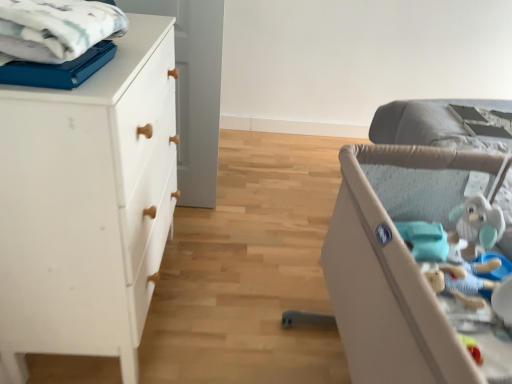
Describe the element at coordinates (399, 265) in the screenshot. The width and height of the screenshot is (512, 384). I see `beige fabric infant bed at right` at that location.

Image resolution: width=512 pixels, height=384 pixels. What are the coordinates of `white matte chest of drawers at left` in the screenshot? It's located at (87, 204).

Does white cotton blanket at upper left have a lesser width compared to white matte chest of drawers at left?

Indeed, white cotton blanket at upper left has a lesser width compared to white matte chest of drawers at left.

Does white cotton blanket at upper left come behind white matte chest of drawers at left?

No, white cotton blanket at upper left is in front of white matte chest of drawers at left.

From the picture: Between white cotton blanket at upper left and white matte chest of drawers at left, which one has larger size?

white matte chest of drawers at left.

Is white cotton blanket at upper left not near white matte chest of drawers at left?

white cotton blanket at upper left is near white matte chest of drawers at left, not far away.

From a real-world perspective, is white matte chest of drawers at left positioned above or below beige fabric infant bed at right?

white matte chest of drawers at left is above beige fabric infant bed at right.

How much distance is there between white matte chest of drawers at left and beige fabric infant bed at right?

61.08 centimeters.

Could you tell me if white matte chest of drawers at left is turned towards beige fabric infant bed at right?

Yes.

From the image's perspective, between white matte chest of drawers at left and beige fabric infant bed at right, who is located below?

beige fabric infant bed at right appears lower in the image.

Is white matte chest of drawers at left wider or thinner than white cotton blanket at upper left?

Considering their sizes, white matte chest of drawers at left looks broader than white cotton blanket at upper left.

Does point (101, 81) come behind point (54, 45)?

Yes, it is.

Is white matte chest of drawers at left oriented towards white cotton blanket at upper left?

No, white matte chest of drawers at left is not turned towards white cotton blanket at upper left.

Is white matte chest of drawers at left bigger than white cotton blanket at upper left?

Yes.

Is beige fabric infant bed at right smaller than white cotton blanket at upper left?

No, beige fabric infant bed at right is not smaller than white cotton blanket at upper left.

Measure the distance from beige fabric infant bed at right to white cotton blanket at upper left.

beige fabric infant bed at right is 28.58 inches away from white cotton blanket at upper left.

From their relative heights in the image, would you say beige fabric infant bed at right is taller or shorter than white cotton blanket at upper left?

Considering their sizes, beige fabric infant bed at right has more height than white cotton blanket at upper left.

Does point (349, 359) come farther from viewer compared to point (42, 55)?

Yes.

Where is `the chest of drawers located above the beige fabric infant bed at right (from a real-world perspective)`? The width and height of the screenshot is (512, 384). the chest of drawers located above the beige fabric infant bed at right (from a real-world perspective) is located at coordinates (87, 204).

Does point (374, 262) appear closer or farther from the camera than point (65, 110)?

Point (374, 262) is positioned farther from the camera compared to point (65, 110).

Is beige fabric infant bed at right positioned behind white matte chest of drawers at left?

No, beige fabric infant bed at right is closer to the camera.

Is beige fabric infant bed at right next to white matte chest of drawers at left and touching it?

No, beige fabric infant bed at right is not making contact with white matte chest of drawers at left.

Considering the relative sizes of white cotton blanket at upper left and beige fabric infant bed at right in the image provided, is white cotton blanket at upper left thinner than beige fabric infant bed at right?

Correct, the width of white cotton blanket at upper left is less than that of beige fabric infant bed at right.

From the image's perspective, is white cotton blanket at upper left beneath beige fabric infant bed at right?

Incorrect, from the image's perspective, white cotton blanket at upper left is higher than beige fabric infant bed at right.

Looking at this image, is white cotton blanket at upper left located outside beige fabric infant bed at right?

Yes.

Measure the distance from white cotton blanket at upper left to beige fabric infant bed at right.

white cotton blanket at upper left and beige fabric infant bed at right are 28.58 inches apart from each other.

This screenshot has width=512, height=384. In order to click on chest of drawers that appears on the left of white cotton blanket at upper left in this screenshot , I will do `click(87, 204)`.

Where is `infant bed that appears below the white matte chest of drawers at left (from the image's perspective)`? infant bed that appears below the white matte chest of drawers at left (from the image's perspective) is located at coordinates (399, 265).

In the scene shown: When comparing their distances from beige fabric infant bed at right, does white cotton blanket at upper left or white matte chest of drawers at left seem closer?

white matte chest of drawers at left is positioned closer to the anchor beige fabric infant bed at right.

From the image, which object appears to be nearer to white matte chest of drawers at left, beige fabric infant bed at right or white cotton blanket at upper left?

white cotton blanket at upper left.

Which object lies nearer to the anchor point white cotton blanket at upper left, beige fabric infant bed at right or white matte chest of drawers at left?

white matte chest of drawers at left is closer to white cotton blanket at upper left.

From the image, which object appears to be nearer to white cotton blanket at upper left, white matte chest of drawers at left or beige fabric infant bed at right?

white matte chest of drawers at left is positioned closer to the anchor white cotton blanket at upper left.

In the scene shown: Based on their spatial positions, is white cotton blanket at upper left or beige fabric infant bed at right closer to white matte chest of drawers at left?

white cotton blanket at upper left.

From the image, which object appears to be farther from beige fabric infant bed at right, white matte chest of drawers at left or white cotton blanket at upper left?

Among the two, white cotton blanket at upper left is located further to beige fabric infant bed at right.

Find the location of a particular element. The image size is (512, 384). cloth situated between white matte chest of drawers at left and beige fabric infant bed at right from left to right is located at coordinates (56, 28).